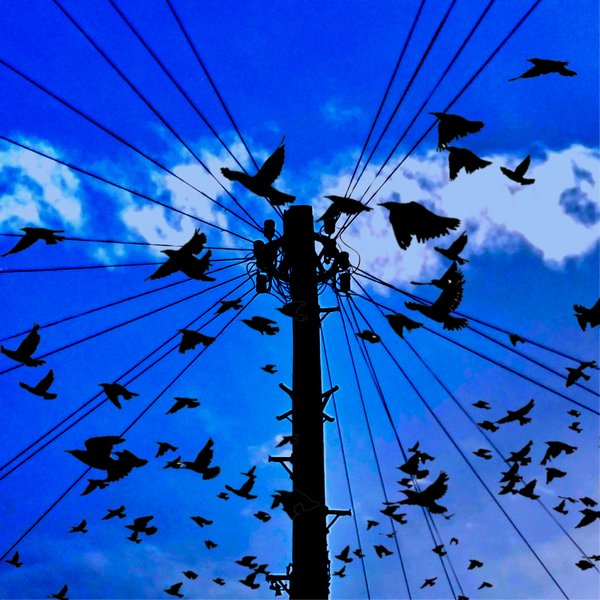
The width and height of the screenshot is (600, 600). In order to click on handle in this screenshot , I will do `click(281, 577)`, `click(335, 509)`, `click(273, 460)`, `click(286, 412)`, `click(278, 383)`, `click(328, 309)`, `click(329, 392)`, `click(327, 417)`.